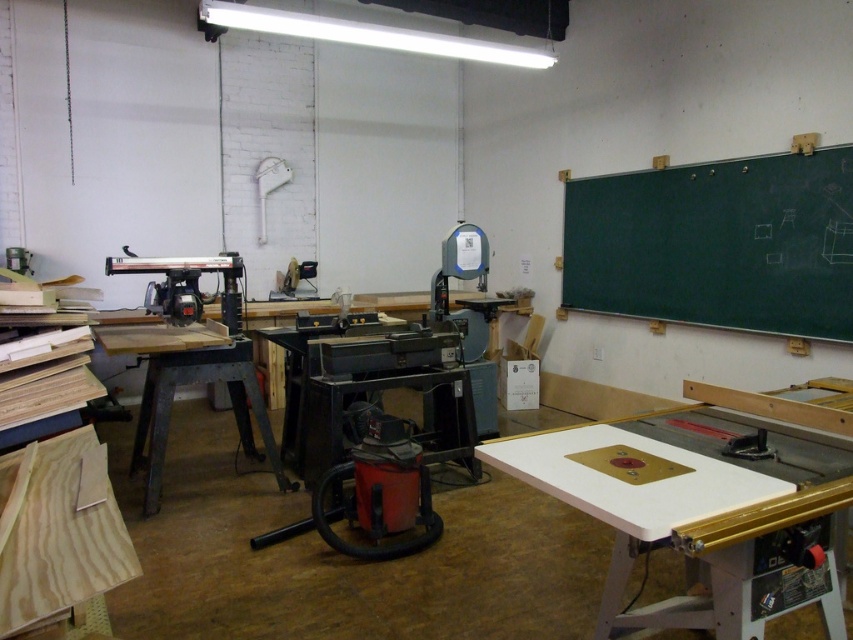
You are organizing a woodworking workshop and need to place a large piece of equipment that requires more space. Which object between the white glossy table at center and the metallic gray workbench at center would you choose to move to accommodate the new equipment?

The white glossy table at center is smaller than the metallic gray workbench at center, so moving the white glossy table at center would free up more space to accommodate the new equipment.

You are organizing tools in a woodworking workshop and need to place a new tool on the closest surface. Which surface should you choose between the green chalkboard at upper right and the metallic gray workbench at center?

You should place the new tool on the metallic gray workbench at center because the green chalkboard at upper right is further away from you, making the workbench closer.

You are a woodworker who needs to place a heavy tool on a surface that is not too high to avoid strain. Which object between the white glossy table at center and the metallic gray workbench at center would be more suitable for this task?

The white glossy table at center has a lesser height compared to the metallic gray workbench at center, making it more suitable for placing heavy tools to avoid strain.